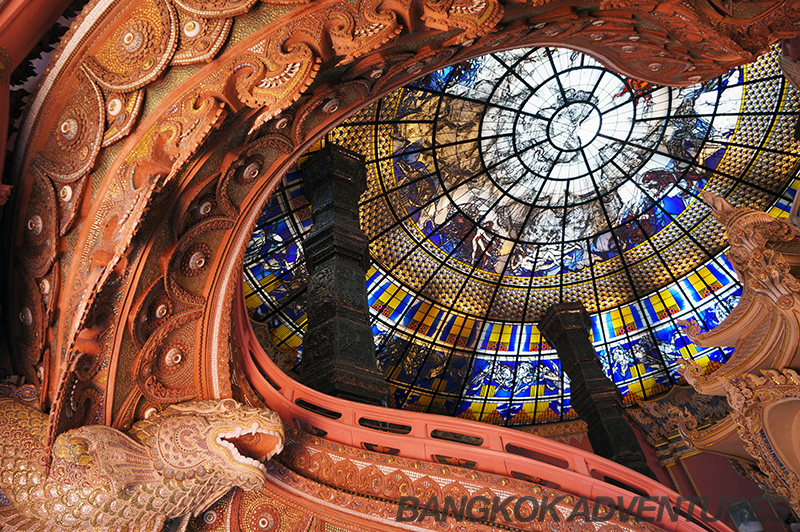
At what (x,y) coordinates should I click in order to perform the action: click on decorative column. Please return your answer as a coordinate pair (x, y). The height and width of the screenshot is (532, 800). Looking at the image, I should click on (349, 345), (590, 380).